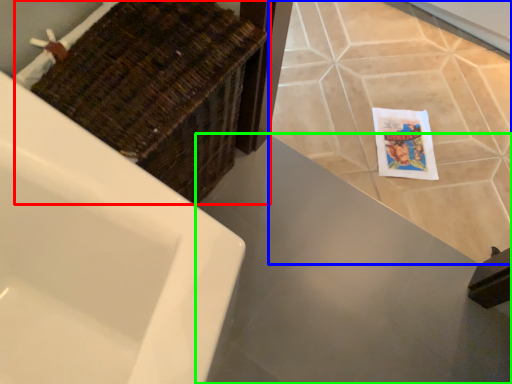
Question: Which object is the closest to the basket (highlighted by a red box)? Choose among these: ceramic tile (highlighted by a blue box) or counter top (highlighted by a green box).

Choices:
 (A) ceramic tile
 (B) counter top

Answer: (B)